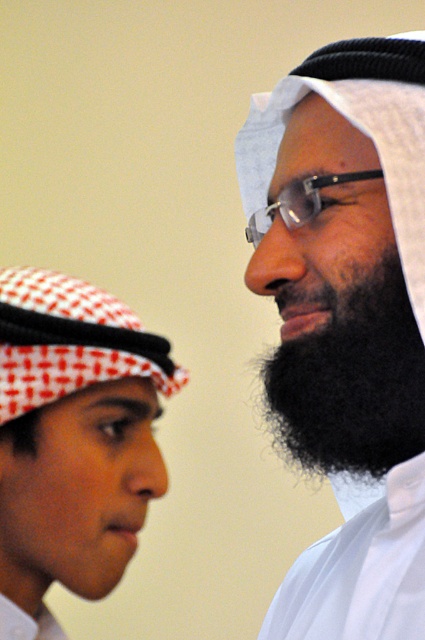
You are standing in front of the image and want to determine which of the two points, point (419, 612) or point (84, 576), is closer to you. Based on the scene, which point is nearer?

Point (419, 612) is closer to you because it is further to the viewer than point (84, 576).

You are a photographer standing 1 meter away from the black matte beard at center. Can you capture the entire beard in your photo without zooming in?

The black matte beard at center is 50.92 centimeters away from the camera. Since you are standing 1 meter away, which is farther than the beard, you can capture the entire beard without zooming in.

You are a photographer standing 5 feet away from the two people in the image. You want to take a photo of both individuals in the same frame. Given that your camera has a maximum focus range of 5 feet, will you be able to capture both the white checkered headscarf at left and the person on the right in focus?

The two individuals are 20.58 inches apart. Since you are standing 5 feet away, which is approximately 60 inches, the distance between them is within the camera focus range. Therefore, you can capture both the white checkered headscarf at left and the person on the right in focus.